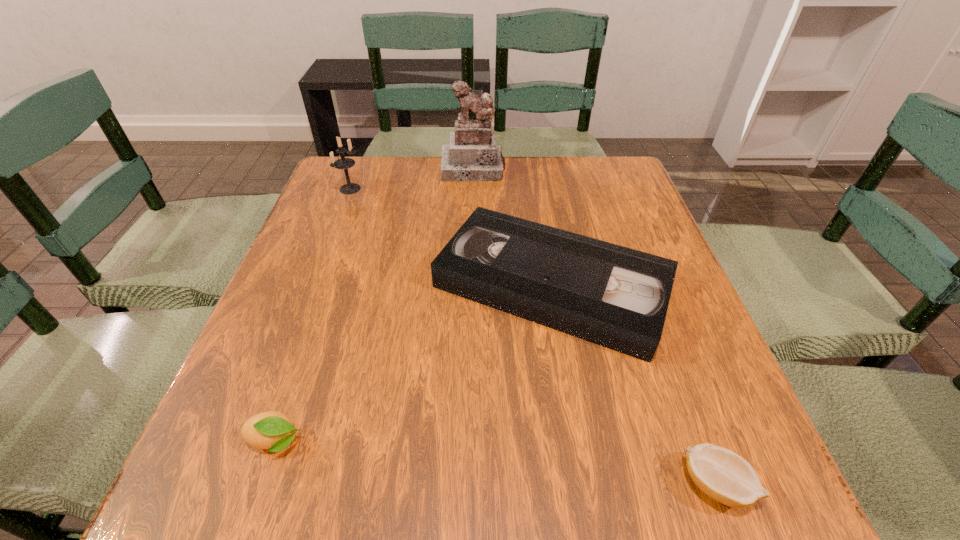
Find the location of a particular element. free space that is in between the figurine and the taller lemon is located at coordinates (374, 305).

Locate an element on the screen. Image resolution: width=960 pixels, height=540 pixels. vacant space that is in between the fourth shortest object and the right lemon is located at coordinates (533, 336).

Where is `empty space between the candle holder and the videotape`? The width and height of the screenshot is (960, 540). empty space between the candle holder and the videotape is located at coordinates (450, 237).

The image size is (960, 540). Find the location of `unoccupied position between the left lemon and the candle holder`. unoccupied position between the left lemon and the candle holder is located at coordinates (313, 315).

Choose which object is the second nearest neighbor to the tallest object. Please provide its 2D coordinates. Your answer should be formatted as a tuple, i.e. [(x, y)], where the tuple contains the x and y coordinates of a point satisfying the conditions above.

[(344, 163)]

Identify which object is the second closest to the candle holder. Please provide its 2D coordinates. Your answer should be formatted as a tuple, i.e. [(x, y)], where the tuple contains the x and y coordinates of a point satisfying the conditions above.

[(617, 297)]

Identify the location of free space that satisfies the following two spatial constraints: 1. with leaves positioned above the right lemon; 2. on the right side of the left lemon. This screenshot has width=960, height=540. (260, 484).

Where is `vacant space that satisfies the following two spatial constraints: 1. on the front-facing side of the figurine; 2. on the left side of the videotape`? This screenshot has height=540, width=960. vacant space that satisfies the following two spatial constraints: 1. on the front-facing side of the figurine; 2. on the left side of the videotape is located at coordinates (470, 286).

At what (x,y) coordinates should I click in order to perform the action: click on free region that satisfies the following two spatial constraints: 1. with leaves positioned above the shorter lemon; 2. on the left side of the left lemon. Please return your answer as a coordinate pair (x, y). This screenshot has height=540, width=960. Looking at the image, I should click on (260, 484).

Find the location of a particular element. Image resolution: width=960 pixels, height=540 pixels. vacant region that satisfies the following two spatial constraints: 1. on the front-facing side of the videotape; 2. on the left side of the figurine is located at coordinates (470, 286).